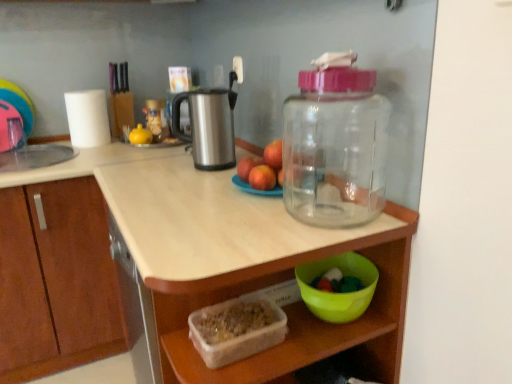
Question: Is green plastic bowl at lower right, positioned as the 2th bowl in left-to-right order, oriented away from translucent plastic container at lower center?

Choices:
 (A) yes
 (B) no

Answer: (A)

Question: Does green plastic bowl at lower right, positioned as the 2th bowl in left-to-right order, have a smaller size compared to translucent plastic container at lower center?

Choices:
 (A) yes
 (B) no

Answer: (A)

Question: From the image's perspective, would you say green plastic bowl at lower right, which is the 1th bowl in right-to-left order, is positioned over translucent plastic container at lower center?

Choices:
 (A) yes
 (B) no

Answer: (A)

Question: Is green plastic bowl at lower right, which is the 1th bowl in right-to-left order, positioned before translucent plastic container at lower center?

Choices:
 (A) yes
 (B) no

Answer: (B)

Question: From a real-world perspective, is green plastic bowl at lower right, which is the 1th bowl in right-to-left order, positioned under translucent plastic container at lower center based on gravity?

Choices:
 (A) yes
 (B) no

Answer: (B)

Question: Considering the positions of red matte apple at center and white matte paper towel at upper left in the image, is red matte apple at center wider or thinner than white matte paper towel at upper left?

Choices:
 (A) wide
 (B) thin

Answer: (B)

Question: Is point (273, 175) closer or farther from the camera than point (83, 94)?

Choices:
 (A) closer
 (B) farther

Answer: (A)

Question: Considering the positions of red matte apple at center and white matte paper towel at upper left in the image, is red matte apple at center taller or shorter than white matte paper towel at upper left?

Choices:
 (A) short
 (B) tall

Answer: (A)

Question: In the image, is red matte apple at center positioned in front of or behind white matte paper towel at upper left?

Choices:
 (A) front
 (B) behind

Answer: (A)

Question: Does point pyautogui.click(x=65, y=185) appear closer or farther from the camera than point pyautogui.click(x=74, y=140)?

Choices:
 (A) farther
 (B) closer

Answer: (B)

Question: Looking at their shapes, would you say matte white countertop at center is wider or thinner than white matte paper towel at upper left?

Choices:
 (A) wide
 (B) thin

Answer: (A)

Question: From a real-world perspective, is matte white countertop at center positioned above or below white matte paper towel at upper left?

Choices:
 (A) above
 (B) below

Answer: (B)

Question: In terms of height, does matte white countertop at center look taller or shorter compared to white matte paper towel at upper left?

Choices:
 (A) tall
 (B) short

Answer: (A)

Question: Does point (184, 306) appear closer or farther from the camera than point (309, 299)?

Choices:
 (A) farther
 (B) closer

Answer: (A)

Question: Considering the positions of translucent plastic container at lower center and green plastic bowl at lower right, positioned as the 2th bowl in left-to-right order, in the image, is translucent plastic container at lower center wider or thinner than green plastic bowl at lower right, positioned as the 2th bowl in left-to-right order,?

Choices:
 (A) thin
 (B) wide

Answer: (B)